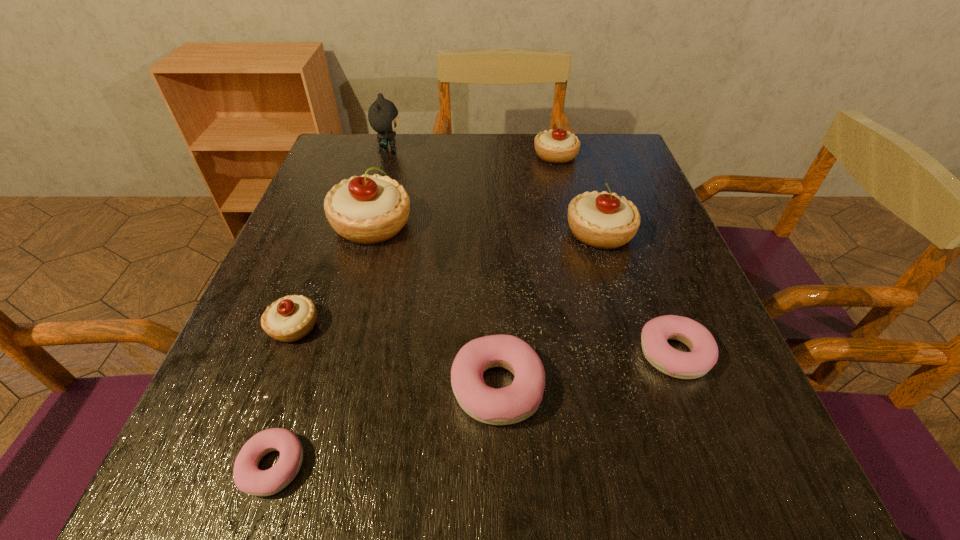
Where is `free space at the near edge of the desktop`? This screenshot has width=960, height=540. free space at the near edge of the desktop is located at coordinates (300, 476).

Locate an element on the screen. vacant region at the left edge of the desktop is located at coordinates (316, 214).

Identify the location of free region at the right edge of the desktop. (652, 197).

The width and height of the screenshot is (960, 540). In order to click on vacant space at the far left corner in this screenshot , I will do `click(334, 141)`.

I want to click on vacant space at the near right corner of the desktop, so click(786, 477).

Identify the location of vacant point located between the kitten and the leftmost pink pastry. (331, 308).

Identify the location of unoccupied area between the nearest pink pastry and the sixth shortest object. (437, 349).

Identify the location of empty location between the biggest beige pastry and the fourth tallest object. (464, 190).

Find the location of `free space between the second biggest pink pastry and the tallest pastry`. free space between the second biggest pink pastry and the tallest pastry is located at coordinates (523, 289).

At what (x,y) coordinates should I click in order to perform the action: click on free spot between the fifth tallest object and the tallest pastry. Please return your answer as a coordinate pair (x, y). The width and height of the screenshot is (960, 540). Looking at the image, I should click on (333, 275).